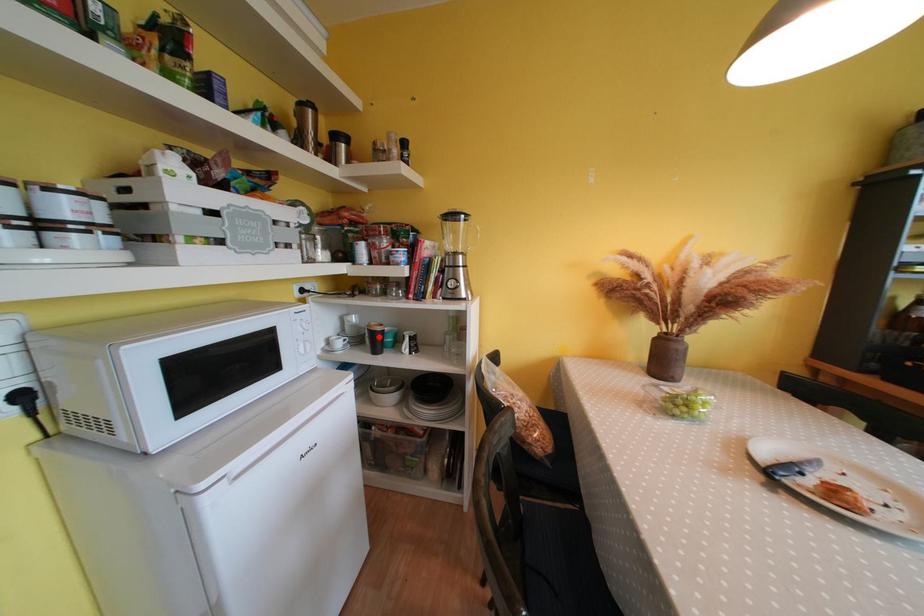
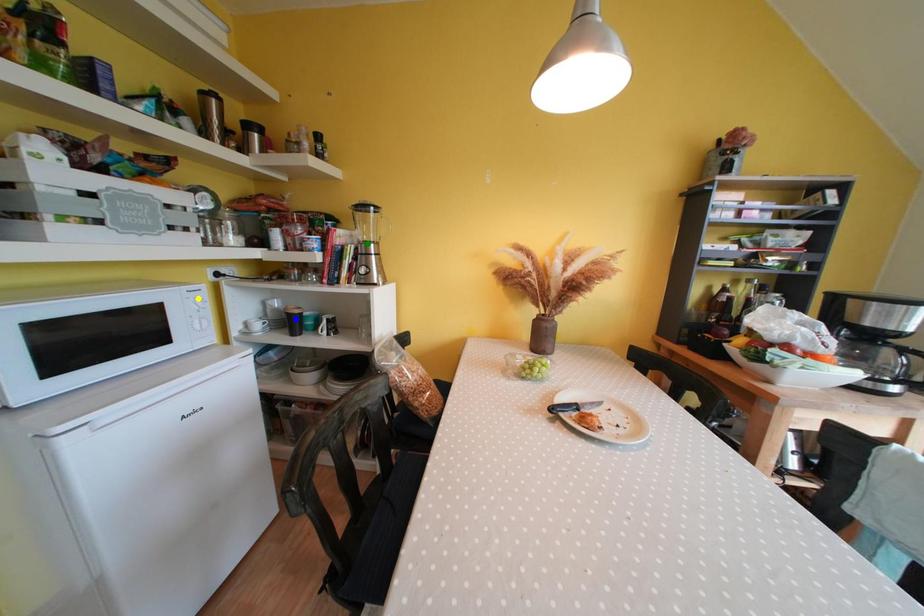
Question: I am providing you with two images of the same scene from different viewpoints. A red point is marked on the first image. You are given multiple points on the second image. Can you choose the point in image 2 that corresponds to the point in image 1?

Choices:
 (A) yellow point
 (B) green point
 (C) blue point

Answer: (C)